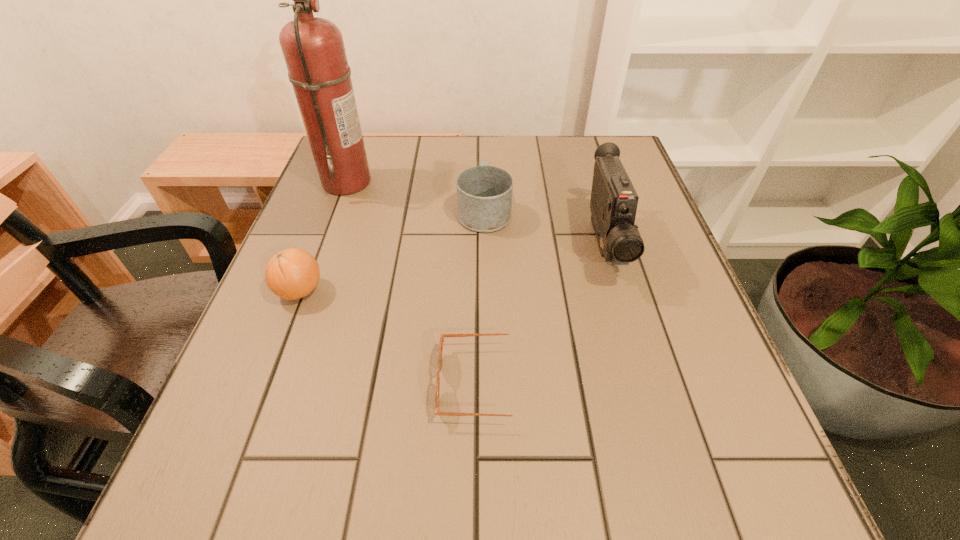
This screenshot has width=960, height=540. I want to click on object that is at the far left corner, so click(x=313, y=48).

Image resolution: width=960 pixels, height=540 pixels. Identify the location of vacant area at the far edge. (477, 141).

In the image, there is a desktop. At what (x,y) coordinates should I click in order to perform the action: click on vacant space at the near edge. Please return your answer as a coordinate pair (x, y). The height and width of the screenshot is (540, 960). Looking at the image, I should click on (406, 513).

In the image, there is a desktop. Identify the location of vacant space at the left edge. The height and width of the screenshot is (540, 960). (247, 418).

In the image, there is a desktop. At what (x,y) coordinates should I click in order to perform the action: click on free space at the right edge. Please return your answer as a coordinate pair (x, y). This screenshot has height=540, width=960. Looking at the image, I should click on (622, 301).

In the image, there is a desktop. Where is `free space at the far left corner`? The image size is (960, 540). free space at the far left corner is located at coordinates coord(368,148).

In the image, there is a desktop. Identify the location of blank space at the far right corner. (630, 156).

Where is `vacant point located between the orange and the rightmost object`? The width and height of the screenshot is (960, 540). vacant point located between the orange and the rightmost object is located at coordinates (452, 268).

The width and height of the screenshot is (960, 540). I want to click on free space between the rightmost object and the shortest object, so click(x=544, y=314).

The width and height of the screenshot is (960, 540). Find the location of `unoccupied position between the fire extinguisher and the mug`. unoccupied position between the fire extinguisher and the mug is located at coordinates (416, 196).